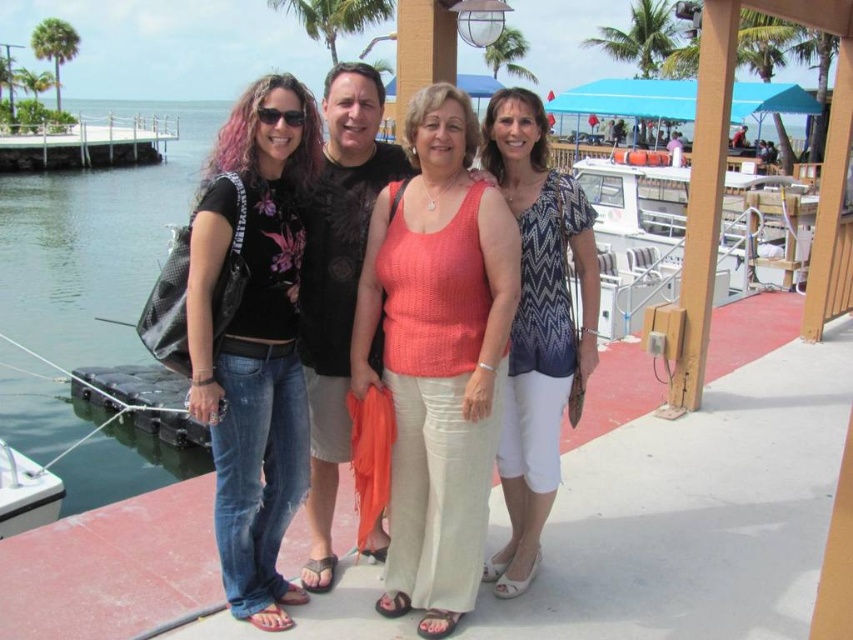
Question: Is matte black shirt at center smaller than denim jeans at left?

Choices:
 (A) yes
 (B) no

Answer: (A)

Question: Which point appears closest to the camera in this image?

Choices:
 (A) (509, 202)
 (B) (242, 346)
 (C) (51, 404)
 (D) (18, 508)

Answer: (B)

Question: Which is nearer to the denim jeans at left?

Choices:
 (A) transparent plastic water at left
 (B) white matte boat at lower left
 (C) matte black shirt at center
 (D) knitted coral tank top at center

Answer: (C)

Question: Does denim jeans at left have a larger size compared to transparent plastic water at left?

Choices:
 (A) yes
 (B) no

Answer: (B)

Question: Is knitted coral tank top at center smaller than transparent plastic water at left?

Choices:
 (A) no
 (B) yes

Answer: (B)

Question: Which point appears farthest from the camera in this image?

Choices:
 (A) (4, 515)
 (B) (486, 237)

Answer: (A)